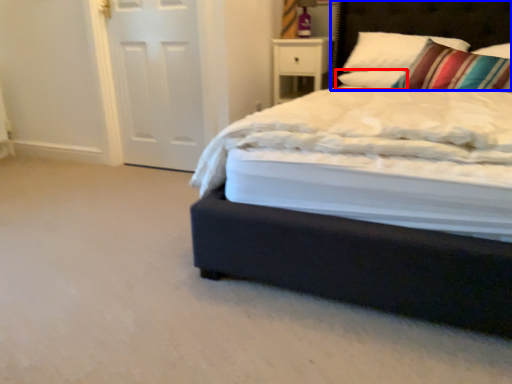
Question: Which point is further to the camera, pillow (highlighted by a red box) or headboard (highlighted by a blue box)?

Choices:
 (A) pillow
 (B) headboard

Answer: (A)